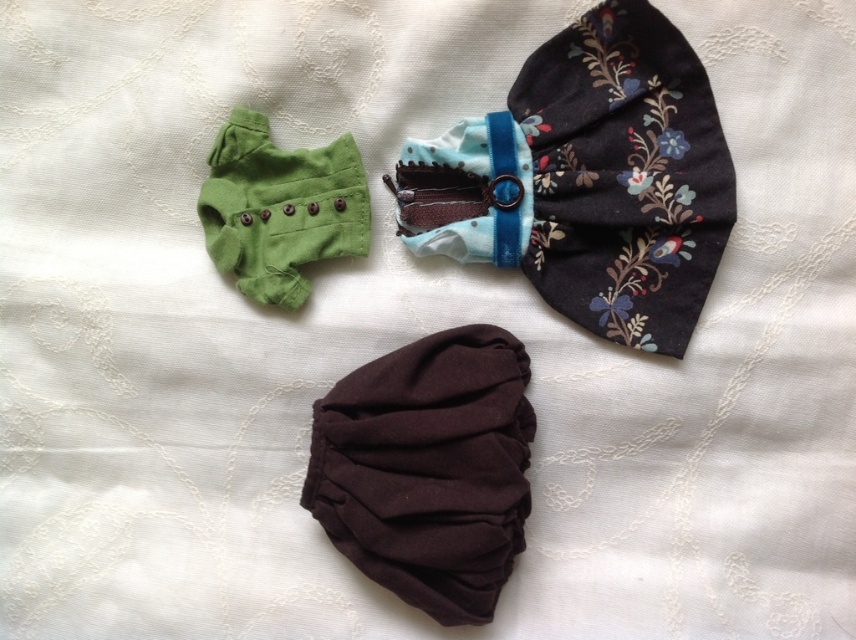
Is floral fabric bow tie at upper center further to camera compared to brown cotton pants at center?

No.

How distant is floral fabric bow tie at upper center from brown cotton pants at center?

The distance of floral fabric bow tie at upper center from brown cotton pants at center is 11.18 inches.

Who is more forward, (560,109) or (506,461)?

Point (506,461)

Find the location of a particular element. The height and width of the screenshot is (640, 856). floral fabric bow tie at upper center is located at coordinates (598, 179).

Can you confirm if brown cotton pants at center is positioned to the left of green cotton pants at upper left?

No, brown cotton pants at center is not to the left of green cotton pants at upper left.

The image size is (856, 640). In order to click on brown cotton pants at center in this screenshot , I will do `click(428, 468)`.

Is point (649, 74) in front of point (294, 304)?

Yes, point (649, 74) is in front of point (294, 304).

Which is behind, point (688, 252) or point (254, 292)?

Positioned behind is point (254, 292).

The width and height of the screenshot is (856, 640). In order to click on floral fabric bow tie at upper center in this screenshot , I will do `click(598, 179)`.